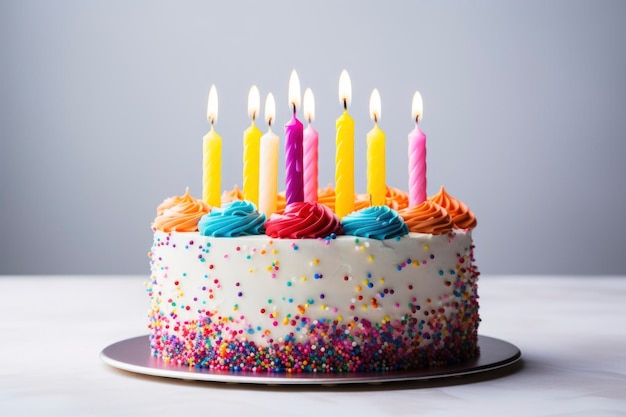
The image size is (626, 417). What are the coordinates of `birthday candles` in the screenshot? It's located at (215, 154), (245, 143), (270, 164), (295, 146), (305, 151), (349, 158), (377, 167), (417, 175).